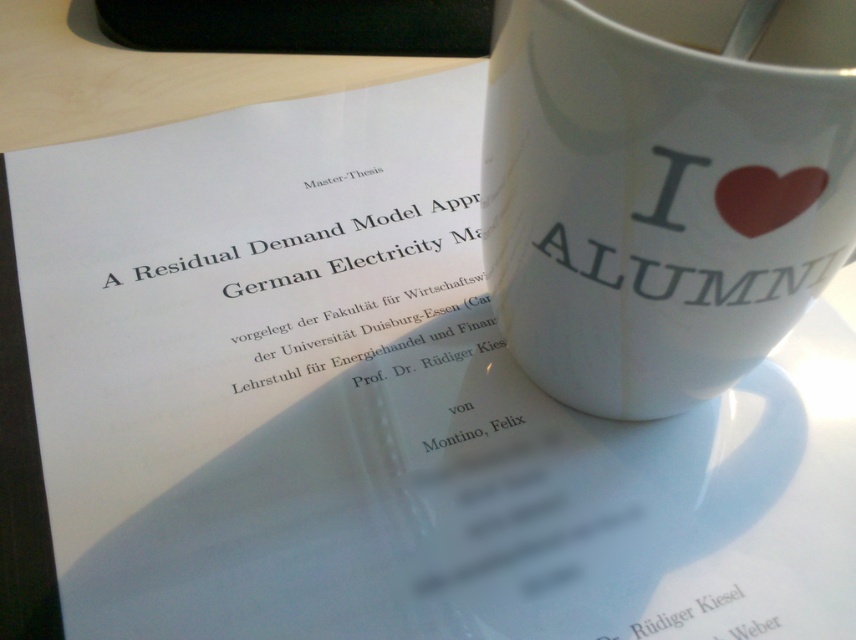
Is white ceramic mug at upper right further to camera compared to white glossy mug at upper center?

That is False.

The width and height of the screenshot is (856, 640). Describe the element at coordinates (663, 188) in the screenshot. I see `white ceramic mug at upper right` at that location.

This screenshot has width=856, height=640. What are the coordinates of `white ceramic mug at upper right` in the screenshot? It's located at (663, 188).